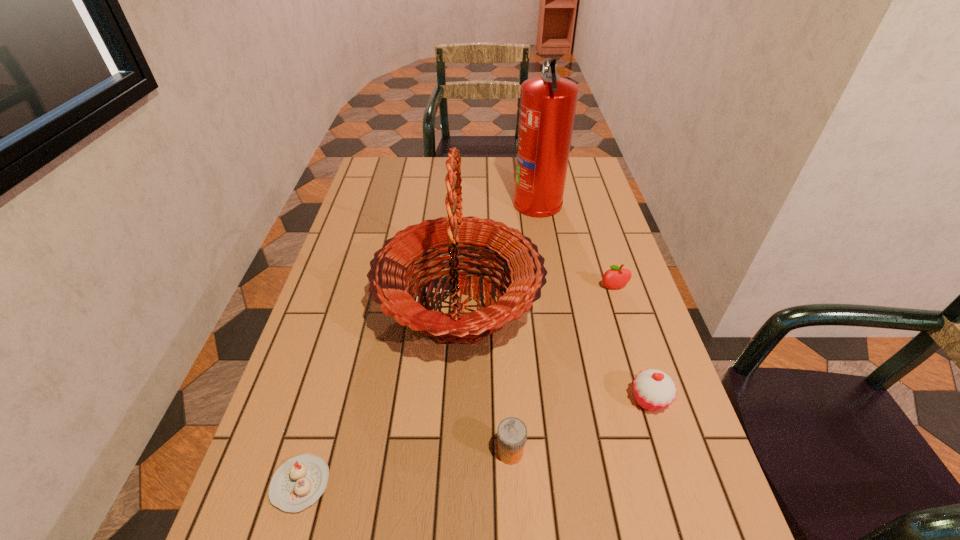
Image resolution: width=960 pixels, height=540 pixels. In order to click on free space located on the instruction side of the farthest object in this screenshot , I will do `click(433, 201)`.

Where is `free region located on the back of the basket`? free region located on the back of the basket is located at coordinates 465,189.

This screenshot has width=960, height=540. What are the coordinates of `vacant position located on the left of the third nearest object` in the screenshot? It's located at (510, 400).

Find the location of `vacant region located 0.170m on the left of the apple`. vacant region located 0.170m on the left of the apple is located at coordinates (541, 288).

Find the location of a particular element. free location located 0.270m on the label side of the medicine is located at coordinates (366, 453).

The height and width of the screenshot is (540, 960). I want to click on vacant space situated 0.370m on the label side of the medicine, so click(x=318, y=453).

Identify the location of free spot located on the label side of the medicine. (347, 453).

You are a GUI agent. You are given a task and a screenshot of the screen. Output one action in this format:
    pyautogui.click(x=<x>, y=<y>)
    Task: Click on the vacant space located on the right of the shortest object
    The height and width of the screenshot is (540, 960).
    Given the screenshot: What is the action you would take?
    pyautogui.click(x=512, y=483)

Identify the location of object that is at the far edge. The width and height of the screenshot is (960, 540). (548, 103).

Locate an element on the screen. The image size is (960, 540). object that is positioned at the left edge is located at coordinates (297, 484).